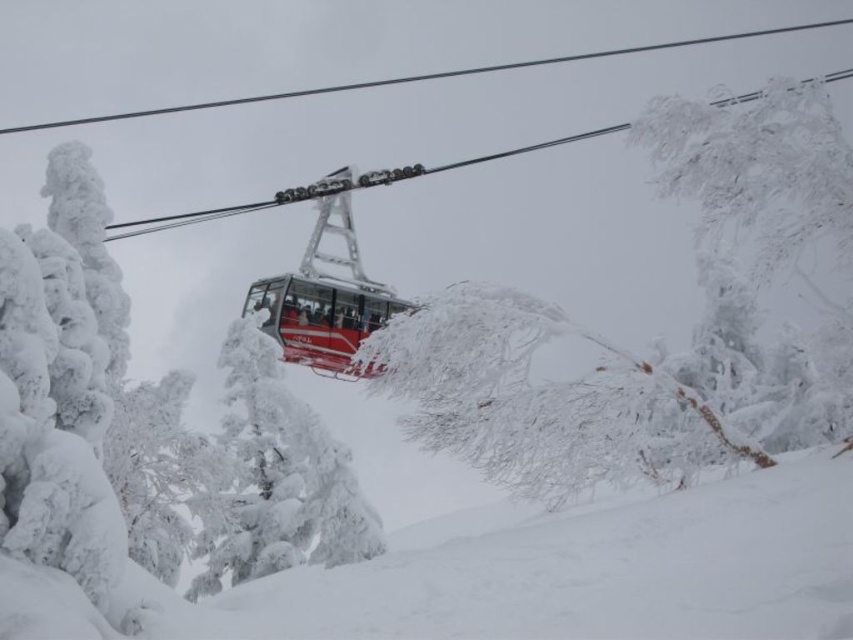
Based on the photo, who is positioned more to the left, frosted glass tree at upper right or metallic red cable car at center?

Positioned to the left is metallic red cable car at center.

You are a GUI agent. You are given a task and a screenshot of the screen. Output one action in this format:
    pyautogui.click(x=<x>, y=<y>)
    Task: Click on the frosted glass tree at upper right
    The width and height of the screenshot is (853, 640).
    Given the screenshot: What is the action you would take?
    pyautogui.click(x=756, y=172)

Locate an element on the screen. The image size is (853, 640). frosted glass tree at upper right is located at coordinates (756, 172).

This screenshot has width=853, height=640. What are the coordinates of `frosted glass tree at upper right` in the screenshot? It's located at click(x=756, y=172).

Which is more to the right, frosted glass tree at upper right or white frosty tree at center?

Positioned to the right is frosted glass tree at upper right.

Locate an element on the screen. frosted glass tree at upper right is located at coordinates (756, 172).

The width and height of the screenshot is (853, 640). In order to click on frosted glass tree at upper right in this screenshot , I will do `click(756, 172)`.

Which of these two, white frosty tree at center or metallic red cable car at center, stands shorter?

With less height is white frosty tree at center.

What do you see at coordinates (281, 474) in the screenshot?
I see `white frosty tree at center` at bounding box center [281, 474].

Where is `white frosty tree at center`? The image size is (853, 640). white frosty tree at center is located at coordinates (281, 474).